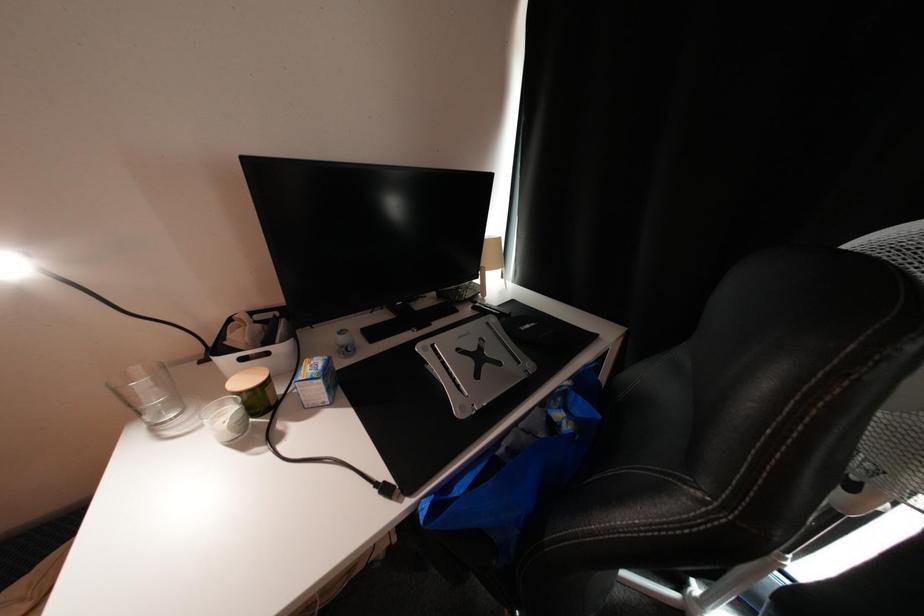
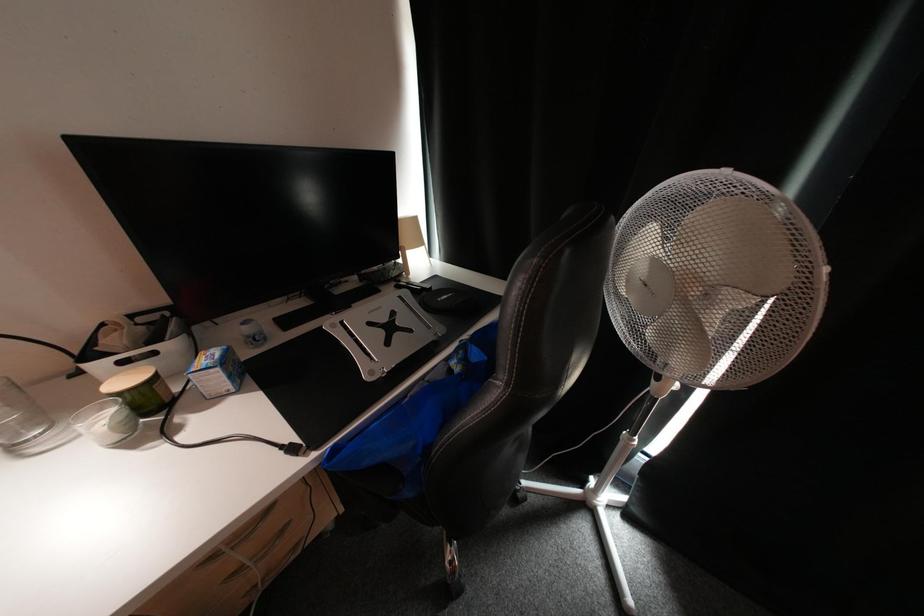
Question: The camera is either moving clockwise (left) or counter-clockwise (right) around the object. The first image is from the beginning of the video and the second image is from the end. Is the camera moving left or right when shooting the video?

Choices:
 (A) Left
 (B) Right

Answer: (A)